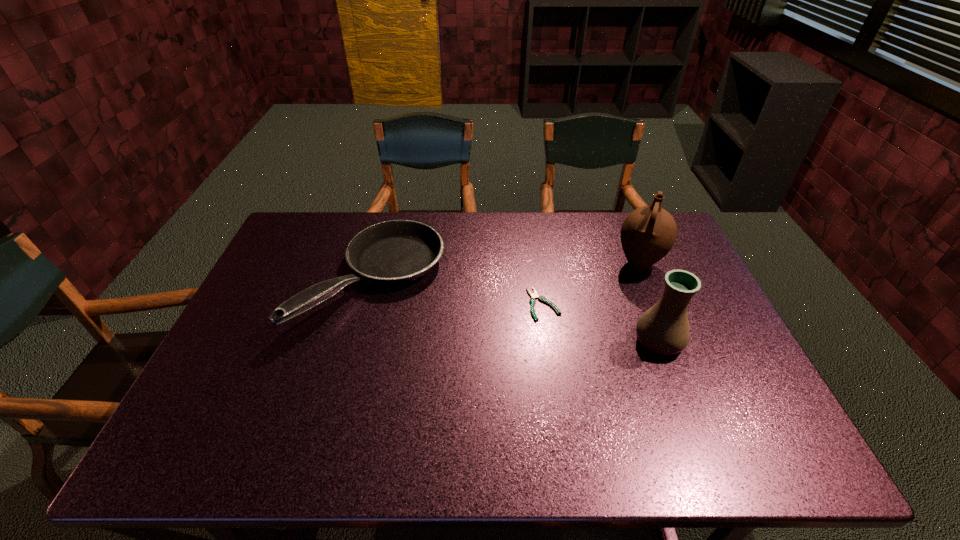
Image resolution: width=960 pixels, height=540 pixels. In the image, there is a desktop. What are the coordinates of `free space at the right edge` in the screenshot? It's located at (720, 353).

The height and width of the screenshot is (540, 960). Identify the location of free spot between the pitcher and the third shortest object. (649, 303).

What are the coordinates of `empty location between the pottery and the third tallest object` in the screenshot? It's located at (516, 310).

Find the location of `vacant space that is in between the pottery and the pitcher`. vacant space that is in between the pottery and the pitcher is located at coordinates (649, 303).

The height and width of the screenshot is (540, 960). I want to click on vacant space that's between the pitcher and the third shortest object, so click(x=649, y=303).

In order to click on vacant point located between the third tallest object and the pitcher in this screenshot , I will do `click(506, 272)`.

Image resolution: width=960 pixels, height=540 pixels. Find the location of `free space between the pottery and the frying pan`. free space between the pottery and the frying pan is located at coordinates (516, 310).

This screenshot has width=960, height=540. Find the location of `empty space between the pitcher and the third tallest object`. empty space between the pitcher and the third tallest object is located at coordinates (506, 272).

The width and height of the screenshot is (960, 540). What are the coordinates of `free space between the second object from left to right and the pitcher` in the screenshot? It's located at (591, 284).

Image resolution: width=960 pixels, height=540 pixels. What are the coordinates of `empty space between the third tallest object and the pitcher` in the screenshot? It's located at (506, 272).